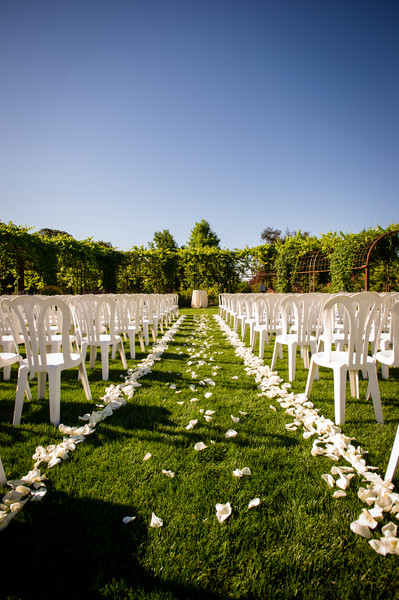
Where is `section of chairs`? This screenshot has height=600, width=399. section of chairs is located at coordinates (83, 352), (315, 342).